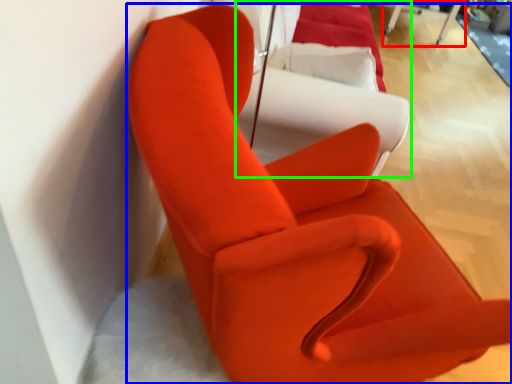
Question: Which object is the farthest from table (highlighted by a red box)? Choose among these: chair (highlighted by a blue box) or couch (highlighted by a green box).

Choices:
 (A) chair
 (B) couch

Answer: (A)